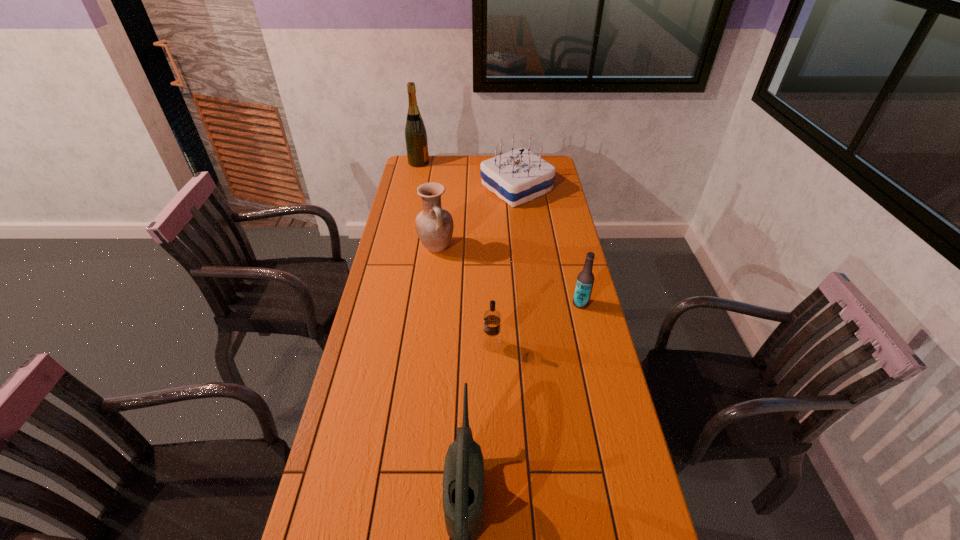
This screenshot has height=540, width=960. What are the coordinates of `birthday cake at the right edge` in the screenshot? It's located at [x=518, y=176].

This screenshot has height=540, width=960. What are the coordinates of `beer bottle that is at the right edge` in the screenshot? It's located at (585, 279).

At what (x,y) coordinates should I click in order to perform the action: click on object that is at the far left corner. Please return your answer as a coordinate pair (x, y). Looking at the image, I should click on (416, 141).

At what (x,y) coordinates should I click in order to perform the action: click on object that is at the far right corner. Please return your answer as a coordinate pair (x, y). Looking at the image, I should click on (518, 176).

You are a GUI agent. You are given a task and a screenshot of the screen. Output one action in this format:
    pyautogui.click(x=<x>, y=<y>)
    Task: Click on the free location at the left edge of the desktop
    The image size is (960, 540).
    Given the screenshot: What is the action you would take?
    pyautogui.click(x=388, y=280)

The height and width of the screenshot is (540, 960). In the image, there is a desktop. What are the coordinates of `vacant area at the right edge` in the screenshot? It's located at (615, 446).

You are a GUI agent. You are given a task and a screenshot of the screen. Output one action in this format:
    pyautogui.click(x=<x>, y=<y>)
    Task: Click on the free space between the beer bottle and the second object from left to right
    This screenshot has height=540, width=960.
    Given the screenshot: What is the action you would take?
    pyautogui.click(x=509, y=275)

At what (x,y) coordinates should I click in order to perform the action: click on free space between the fourth farthest object and the second farthest object. Please return your answer as a coordinate pair (x, y). Looking at the image, I should click on (548, 246).

Locate an element on the screen. Image resolution: width=960 pixels, height=540 pixels. blank region between the fourth farthest object and the second nearest object is located at coordinates (536, 324).

Find the location of `free point between the pottery and the birthday cake`. free point between the pottery and the birthday cake is located at coordinates (476, 218).